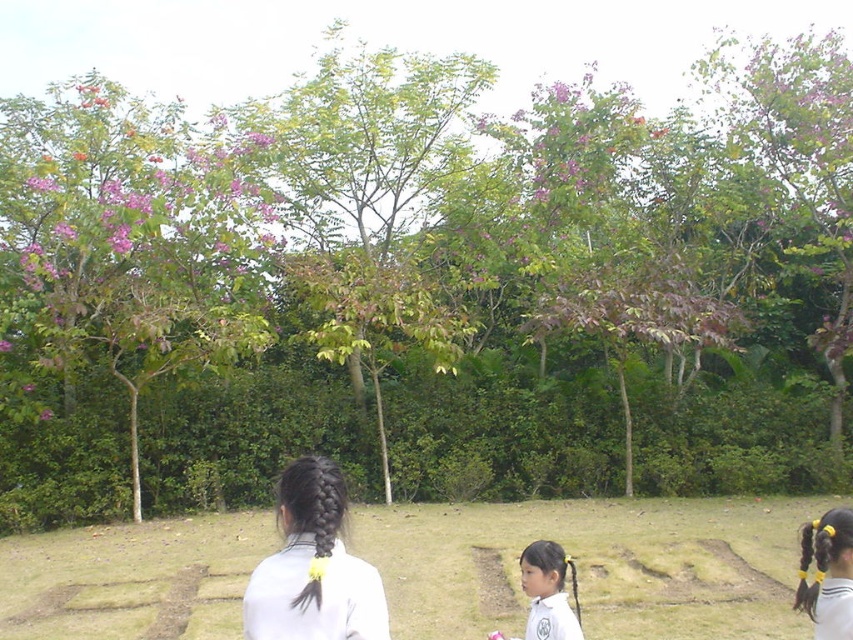
You are a photographer trying to capture a group photo of the black hair at center and the light brown hair at lower center. Since you want to ensure both subjects are in focus, you need to know which hair is wider. Which one has a greater width?

The black hair at center has a greater width than the light brown hair at lower center.